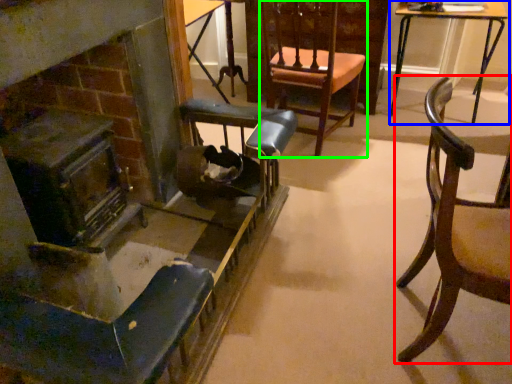
Question: Which object is positioned farthest from chair (highlighted by a red box)? Select from table (highlighted by a blue box) and chair (highlighted by a green box).

Choices:
 (A) table
 (B) chair

Answer: (A)